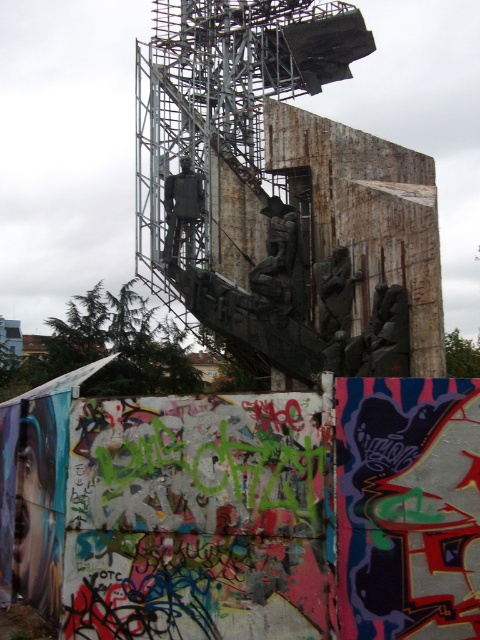
In the scene shown: Can you confirm if rustic stone statue at center is thinner than rusty metal statue at center?

No.

Is point (403, 330) farther from viewer compared to point (348, 326)?

No, it is not.

Is point (379, 307) positioned after point (326, 276)?

That is False.

Where is `rustic stone statue at center`? The image size is (480, 640). rustic stone statue at center is located at coordinates (382, 337).

Between shiny metallic statue at center and rusty metal statue at center, which one has more height?

shiny metallic statue at center is taller.

Does shiny metallic statue at center appear on the left side of rusty metal statue at center?

Correct, you'll find shiny metallic statue at center to the left of rusty metal statue at center.

At what (x,y) coordinates should I click in order to perform the action: click on shiny metallic statue at center. Please return your answer as a coordinate pair (x, y). The width and height of the screenshot is (480, 640). Looking at the image, I should click on (181, 211).

Is rustic stone statue at center below shiny metallic statue at center?

Yes, rustic stone statue at center is below shiny metallic statue at center.

Between point (396, 301) and point (182, 204), which one is positioned behind?

The point (182, 204) is behind.

Is point (396, 310) farther from viewer compared to point (192, 200)?

No, it is in front of (192, 200).

You are a GUI agent. You are given a task and a screenshot of the screen. Output one action in this format:
    pyautogui.click(x=<x>, y=<y>)
    Task: Click on the rustic stone statue at center
    This screenshot has height=640, width=480.
    Given the screenshot: What is the action you would take?
    pyautogui.click(x=382, y=337)